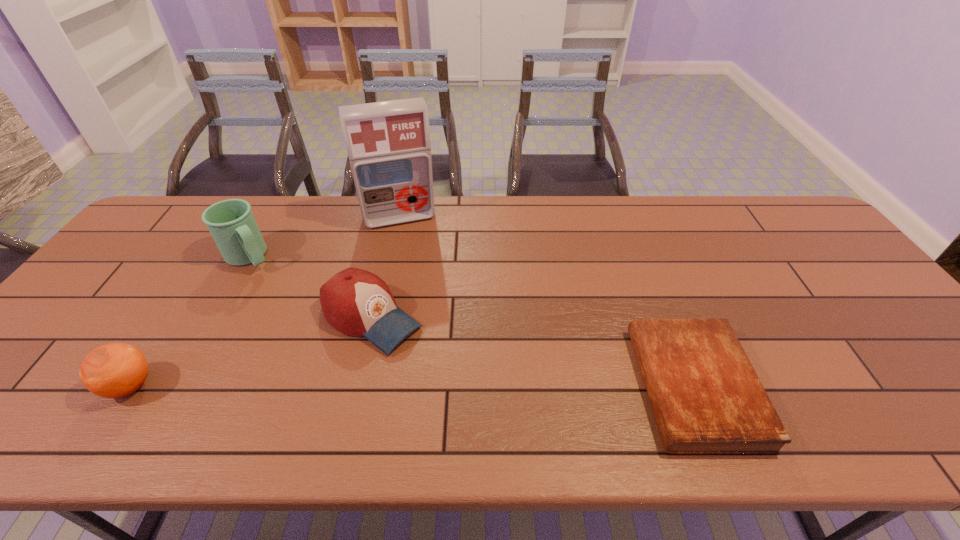
Where is `object that is the fourth nearest to the first-aid kit`? object that is the fourth nearest to the first-aid kit is located at coordinates (706, 397).

Where is `free space in the image that satisfies the following two spatial constraints: 1. on the front side of the fourth shortest object; 2. on the spine side of the shortest object`? This screenshot has height=540, width=960. free space in the image that satisfies the following two spatial constraints: 1. on the front side of the fourth shortest object; 2. on the spine side of the shortest object is located at coordinates (177, 387).